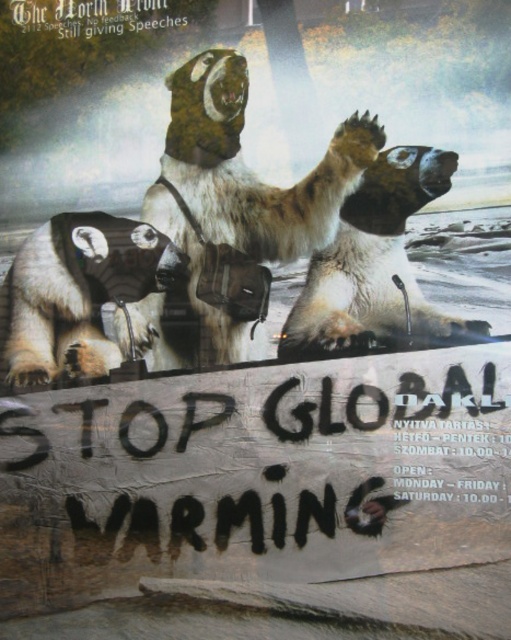
Does furry white bear at center have a lesser width compared to white fur polar bear at lower left?

No.

Does furry white bear at center have a greater width compared to white fur polar bear at lower left?

Indeed, furry white bear at center has a greater width compared to white fur polar bear at lower left.

Between point (120, 340) and point (85, 346), which one is positioned in front?

Point (120, 340) is in front.

Where is `furry white bear at center`? This screenshot has width=511, height=640. furry white bear at center is located at coordinates (243, 186).

Can you confirm if fur-covered polar bear at center is smaller than white fur polar bear at lower left?

No.

Who is more distant from viewer, [336,248] or [78,292]?

Positioned behind is point [78,292].

I want to click on fur-covered polar bear at center, so click(x=374, y=264).

Can you confirm if wooden signboard at center is thinner than furry white bear at center?

No, wooden signboard at center is not thinner than furry white bear at center.

Does point (55, 426) come farther from viewer compared to point (216, 170)?

Yes, point (55, 426) is behind point (216, 170).

Where is `wooden signboard at center`? Image resolution: width=511 pixels, height=640 pixels. wooden signboard at center is located at coordinates (265, 468).